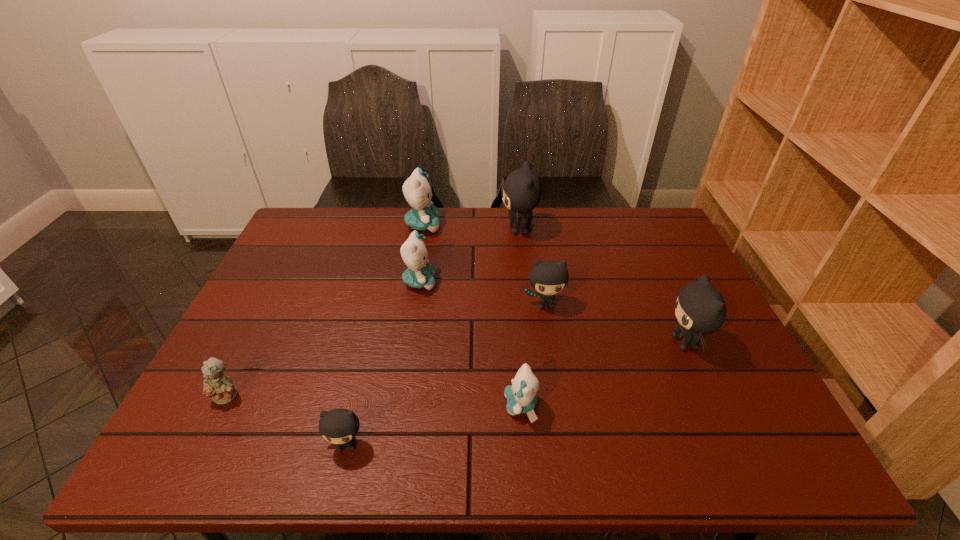
The width and height of the screenshot is (960, 540). Identify the location of the leftmost gray kitten. (339, 426).

You are a GUI agent. You are given a task and a screenshot of the screen. Output one action in this format:
    pyautogui.click(x=<x>, y=<y>)
    Task: Click on the nearest kitten
    The width and height of the screenshot is (960, 540).
    Given the screenshot: What is the action you would take?
    pyautogui.click(x=339, y=426)

Where is `blank area located on the front-facing side of the farthest gray kitten`? blank area located on the front-facing side of the farthest gray kitten is located at coordinates point(447,230).

This screenshot has width=960, height=540. In order to click on free space located 0.160m on the front-facing side of the farthest gray kitten in this screenshot , I will do pos(453,230).

You are a GUI agent. You are given a task and a screenshot of the screen. Output one action in this format:
    pyautogui.click(x=<x>, y=<y>)
    Task: Click on the vacant position located 0.220m on the front-facing side of the farthest gray kitten
    This screenshot has height=540, width=960.
    Given the screenshot: What is the action you would take?
    pyautogui.click(x=436, y=230)

The width and height of the screenshot is (960, 540). What are the coordinates of `blank space located on the face of the farthest blue kitten` in the screenshot? It's located at (512, 225).

Where is `vacant region located 0.230m on the front-facing side of the rightmost gray kitten`? The image size is (960, 540). vacant region located 0.230m on the front-facing side of the rightmost gray kitten is located at coordinates (573, 342).

Locate an element on the screen. Image resolution: width=960 pixels, height=540 pixels. free location located 0.160m on the front-facing side of the rightmost gray kitten is located at coordinates (601, 342).

This screenshot has height=540, width=960. In order to click on vacant space located 0.110m on the front-facing side of the rightmost gray kitten in this screenshot , I will do `click(621, 342)`.

Image resolution: width=960 pixels, height=540 pixels. I want to click on vacant space located 0.200m on the face of the second nearest blue kitten, so click(505, 282).